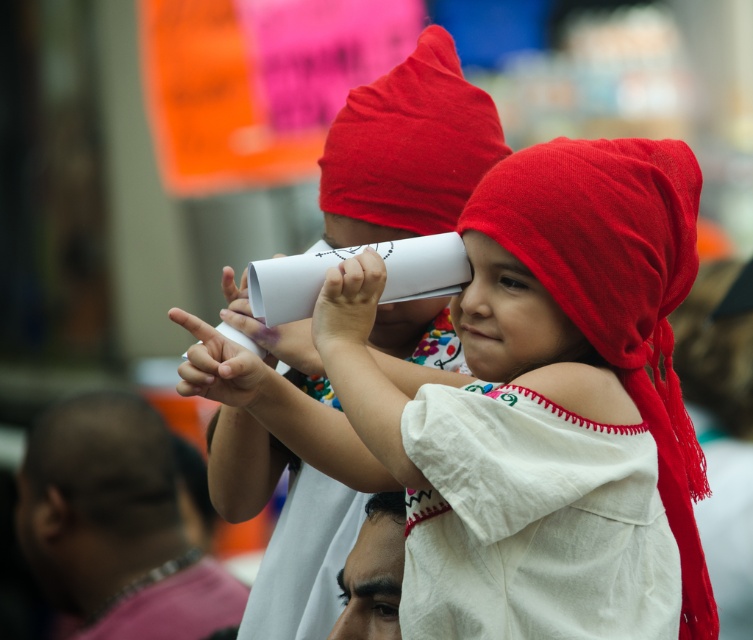
Is bald skin at lower left thinner than white soft fabric shoulder at center?

Incorrect, bald skin at lower left's width is not less than white soft fabric shoulder at center's.

Is point (44, 508) behind point (611, 422)?

Yes.

Does point (75, 412) come farther from viewer compared to point (541, 387)?

That is True.

The image size is (753, 640). In order to click on bald skin at lower left in this screenshot , I will do `click(96, 499)`.

Is red cotton headdress at center closer to the viewer compared to white soft fabric shoulder at center?

That is False.

Is point (686, 416) farther from viewer compared to point (544, 368)?

That is True.

Find the location of a particular element. This screenshot has width=753, height=640. red cotton headdress at center is located at coordinates (617, 289).

Based on the photo, does matte white paper at center have a larger size compared to red cotton headdress at center?

Correct, matte white paper at center is larger in size than red cotton headdress at center.

Is matte white paper at center to the right of red cotton headdress at center from the viewer's perspective?

In fact, matte white paper at center is to the left of red cotton headdress at center.

This screenshot has height=640, width=753. I want to click on matte white paper at center, so [288, 483].